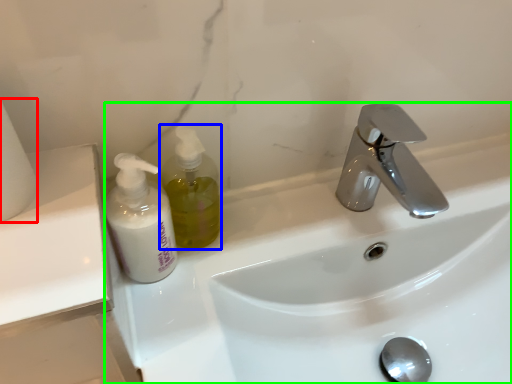
Question: Considering the real-world distances, which object is closest to toilet paper (highlighted by a red box)? soap dispenser (highlighted by a blue box) or sink (highlighted by a green box).

Choices:
 (A) soap dispenser
 (B) sink

Answer: (A)